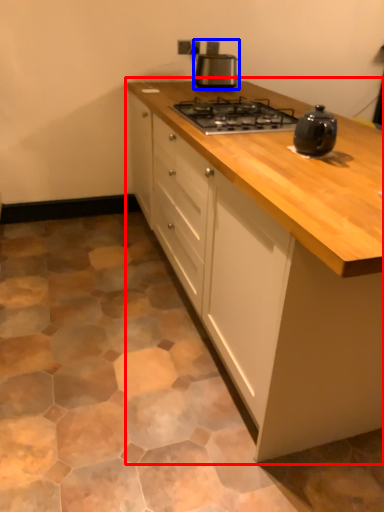
Question: Among these objects, which one is nearest to the camera, cabinetry (highlighted by a red box) or kitchen appliance (highlighted by a blue box)?

Choices:
 (A) cabinetry
 (B) kitchen appliance

Answer: (A)